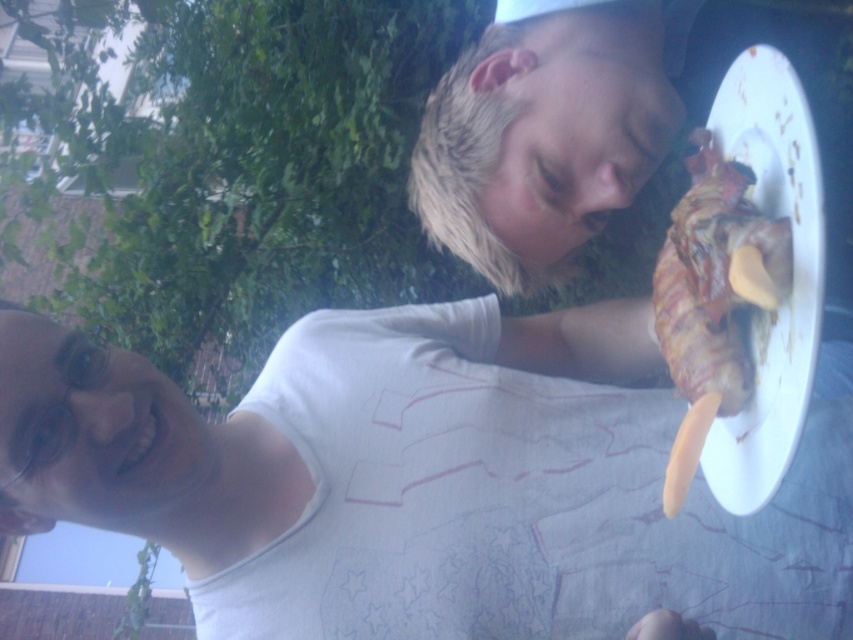
You are standing in a park and see a person wearing a white matte shirt at center and holding a white matte plate at upper right. Which object is closer to you?

The white matte shirt at center is closer to you than the white matte plate at upper right because it is further to the viewer.

You are a photographer trying to capture the white matte shirt at center and the grilled meat with cheese at right in a single shot. Since the shirt is under the food, will you need to adjust your camera angle to include both in the frame?

Yes, you need to adjust your camera angle because the white matte shirt at center is positioned under the grilled meat with cheese at right, so tilting the camera slightly upward or moving it to a lower position might help capture both in the frame.

You are standing at the origin point in the scene. Which direction should you move to reach the white matte plate at upper right?

The white matte plate at upper right is located at point 0.430 in the x and 0.931 in the y coordinates. Since you are at the origin, you should move towards the upper right direction to reach it.